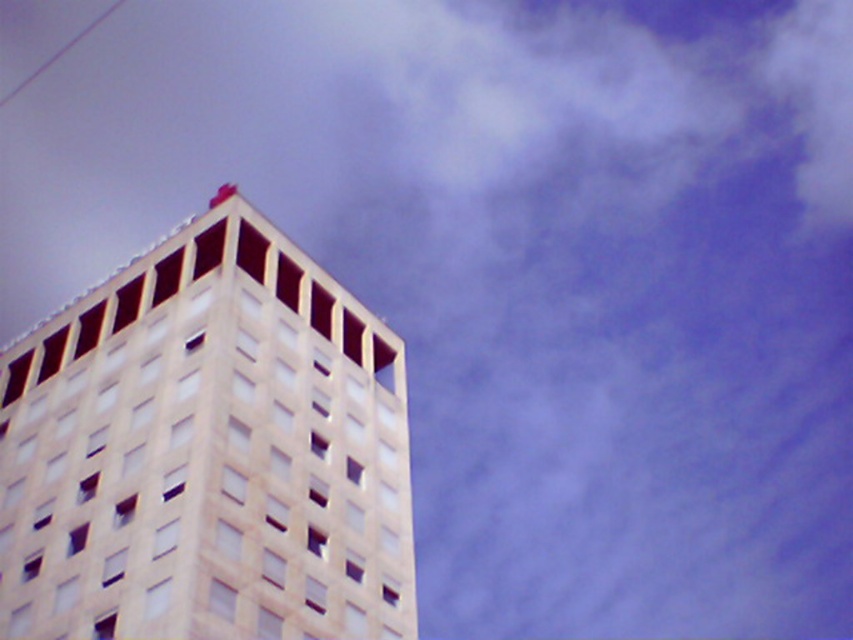
You are an architect reviewing a cityscape design. You notice the white stone building at upper left and the smooth white wire at upper left in the design. Which object would be more visible to someone standing at the city center looking towards the building?

The white stone building at upper left is in front of the smooth white wire at upper left, so the building would block part of the wire, making the building more visible than the wire.

You are standing in front of the tall building on the left side of the image. You notice two points marked on the building. One is at point coordinates point (219, 637) and the other is at point coordinates point (41, 67). Which point is closer to you?

Point (219, 637) is closer to the viewer than point (41, 67).